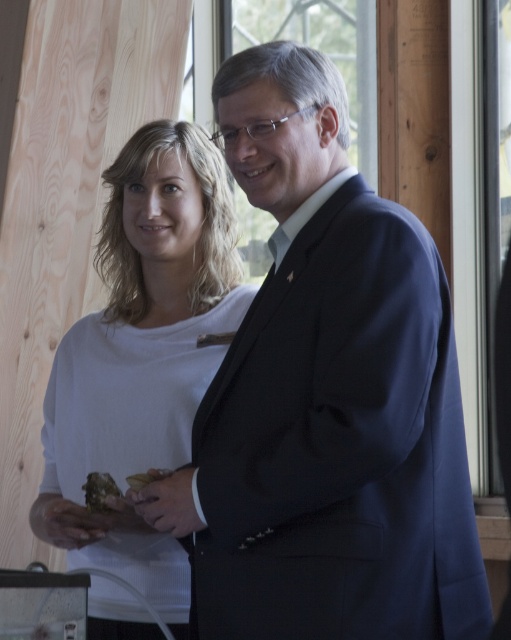
Question: Is matte brown bread at center behind brown crumbly bread at center?

Choices:
 (A) no
 (B) yes

Answer: (B)

Question: Which point appears closest to the camera in this image?

Choices:
 (A) (259, 106)
 (B) (164, 211)
 (C) (106, 509)

Answer: (A)

Question: Is white matte sweater at center to the right of matte brown bread at center from the viewer's perspective?

Choices:
 (A) yes
 (B) no

Answer: (A)

Question: Considering the relative positions of dark blue suit at center and matte brown bread at center in the image provided, where is dark blue suit at center located with respect to matte brown bread at center?

Choices:
 (A) right
 (B) left

Answer: (A)

Question: Which point is farther from the camera taking this photo?

Choices:
 (A) (107, 509)
 (B) (131, 145)
 (C) (130, 484)

Answer: (B)

Question: Among these objects, which one is nearest to the camera?

Choices:
 (A) dark blue suit at center
 (B) white matte sweater at center
 (C) brown crumbly bread at center
 (D) matte brown bread at center

Answer: (A)